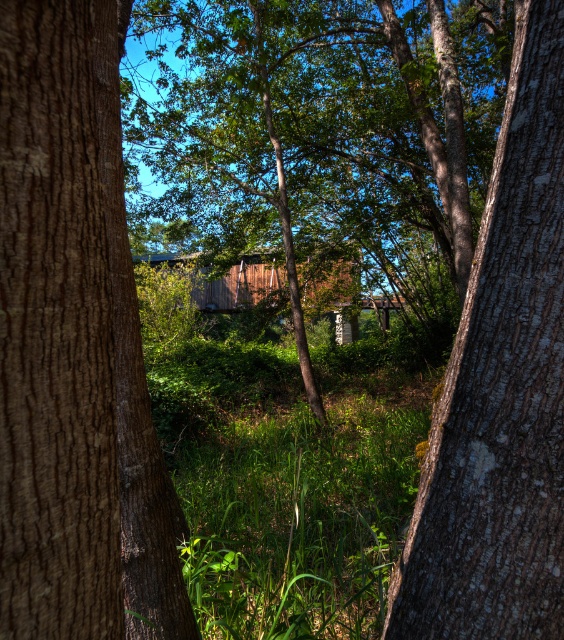
In the scene shown: You are standing at the camera position looking at the point marked at coordinates (6, 220). If you want to place a 30 inch long stick horizontally from the camera to that point, will it reach the point?

The distance between the camera and the point marked at coordinates (6, 220) is 36.17 inches. Since the stick is only 30 inches long, it will not reach the point.

You are standing at the base of the trees in the image and want to walk towards the covered bridge. Which point, point [121,595] or point [552,452], is closer to you as you face the bridge?

Point [121,595] is closer to you because it is in front of point [552,452].

You are standing in the natural scene and want to touch the brown rough bark tree trunk at left. What are the coordinates where you should reach out to?

The coordinates to reach out to the brown rough bark tree trunk at left are at point [73,348].